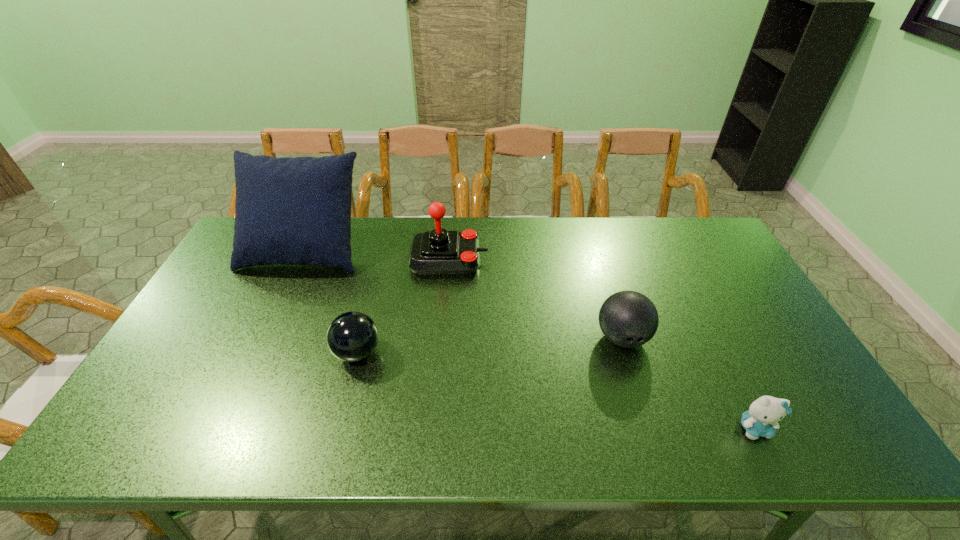
I want to click on vacant space at the far edge of the desktop, so click(x=555, y=242).

What are the coordinates of `vacant area at the near edge of the desktop` in the screenshot? It's located at (417, 435).

Image resolution: width=960 pixels, height=540 pixels. In the image, there is a desktop. Identify the location of free region at the left edge. (237, 293).

At what (x,y) coordinates should I click in order to perform the action: click on vacant region at the right edge of the desktop. Please return your answer as a coordinate pair (x, y). The image size is (960, 540). Looking at the image, I should click on (723, 333).

Locate an element on the screen. Image resolution: width=960 pixels, height=540 pixels. free point between the second object from right to left and the cushion is located at coordinates (464, 293).

Find the location of a particular element. This screenshot has height=540, width=960. free point between the kitten and the third object from right to left is located at coordinates (602, 343).

Identify the location of empty space between the second tallest object and the shortest object. This screenshot has height=540, width=960. (602, 343).

At what (x,y) coordinates should I click in order to perform the action: click on free space between the second object from right to left and the shorter bowling ball. Please return your answer as a coordinate pair (x, y). Image resolution: width=960 pixels, height=540 pixels. Looking at the image, I should click on (490, 345).

Where is `free spot between the shortest object and the fourth object from right to left`? The width and height of the screenshot is (960, 540). free spot between the shortest object and the fourth object from right to left is located at coordinates (556, 390).

Where is `empty location between the right bowling ball and the cushion`? This screenshot has width=960, height=540. empty location between the right bowling ball and the cushion is located at coordinates (464, 293).